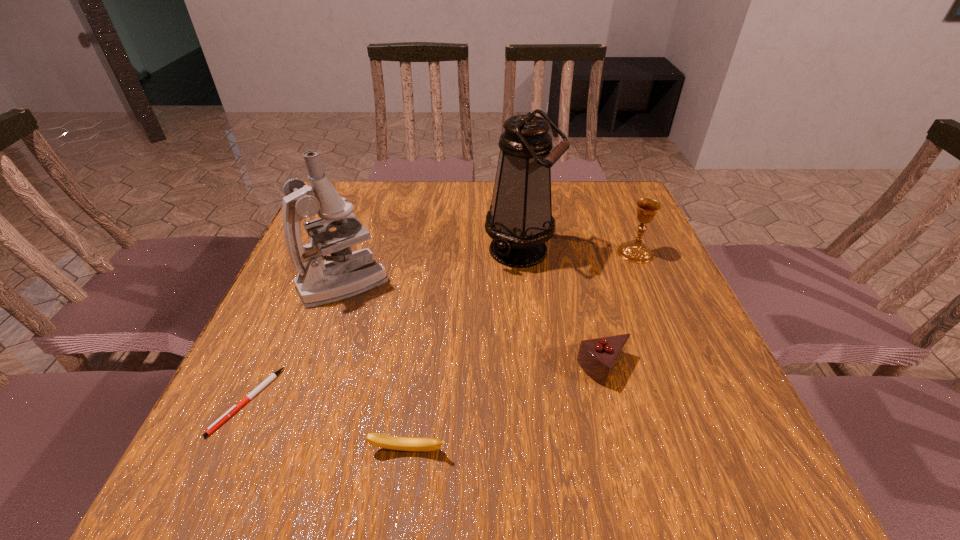
Identify the location of free space at the near right corner. (727, 454).

I want to click on vacant space that's between the pen and the microscope, so click(x=296, y=341).

Find the location of `free space between the fifth tallest object and the fourth shortest object`. free space between the fifth tallest object and the fourth shortest object is located at coordinates (521, 352).

Where is `vacant region between the oil lamp and the shortest object`? The image size is (960, 540). vacant region between the oil lamp and the shortest object is located at coordinates (384, 325).

Identify the location of free space between the shortest object and the oil lamp. This screenshot has width=960, height=540. (384, 325).

Where is `vacant point located between the oil lamp and the chocolate cake`? vacant point located between the oil lamp and the chocolate cake is located at coordinates (562, 309).

In order to click on unoccupied area between the chocolate cake and the rightmost object in this screenshot , I will do `click(619, 310)`.

You are a GUI agent. You are given a task and a screenshot of the screen. Output one action in this format:
    pyautogui.click(x=<x>, y=<y>)
    Task: Click on the free space between the oil lamp and the microscope
    The width and height of the screenshot is (960, 540).
    Given the screenshot: What is the action you would take?
    point(432,266)

Locate an element on the screen. free space that is in between the rightmost object and the oil lamp is located at coordinates (578, 251).

Locate an element on the screen. The width and height of the screenshot is (960, 540). vacant space that's between the oil lamp and the shortest object is located at coordinates (384, 325).